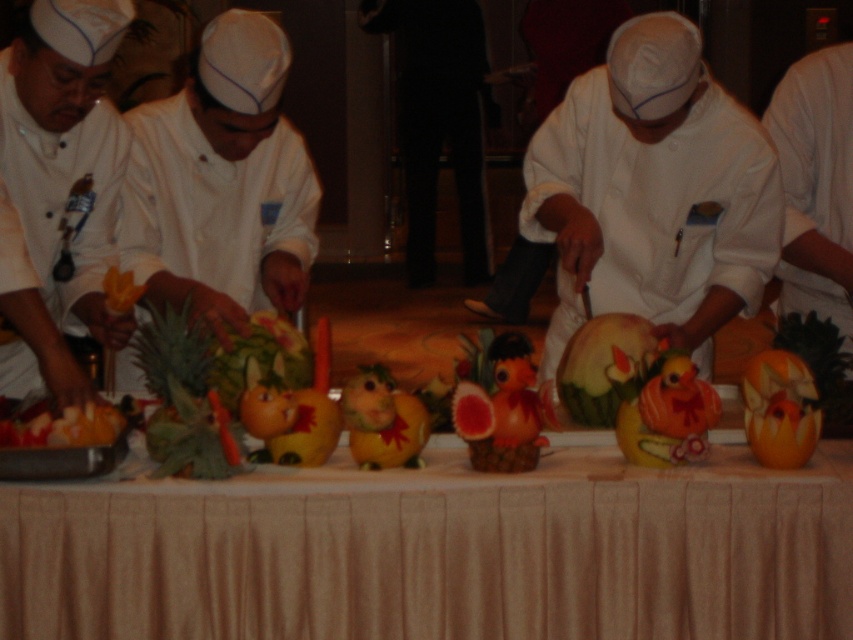
Based on the photo, can you confirm if white matte chef hat at center is thinner than matte white chef at left?

No.

Can you confirm if white matte chef hat at center is positioned above matte white chef at left?

Yes.

Is point (251, 131) less distant than point (28, 211)?

No, it is not.

You are a GUI agent. You are given a task and a screenshot of the screen. Output one action in this format:
    pyautogui.click(x=<x>, y=<y>)
    Task: Click on the white matte chef hat at center
    Image resolution: width=853 pixels, height=640 pixels.
    Given the screenshot: What is the action you would take?
    pyautogui.click(x=221, y=182)

Is smooth orange pumpkin at center smaller than smooth orange fruit at center?

Actually, smooth orange pumpkin at center might be larger than smooth orange fruit at center.

Which of these two, smooth orange pumpkin at center or smooth orange fruit at center, stands taller?

Standing taller between the two is smooth orange pumpkin at center.

Where is `smooth orange pumpkin at center`? The width and height of the screenshot is (853, 640). smooth orange pumpkin at center is located at coordinates (604, 368).

Which is above, matte white chef at left or smooth orange pumpkin at center?

matte white chef at left

Is point (68, 128) farther from camera compared to point (573, 349)?

No, it is in front of (573, 349).

The image size is (853, 640). I want to click on matte white chef at left, so click(61, 186).

The width and height of the screenshot is (853, 640). Identify the location of matte white chef at left. (61, 186).